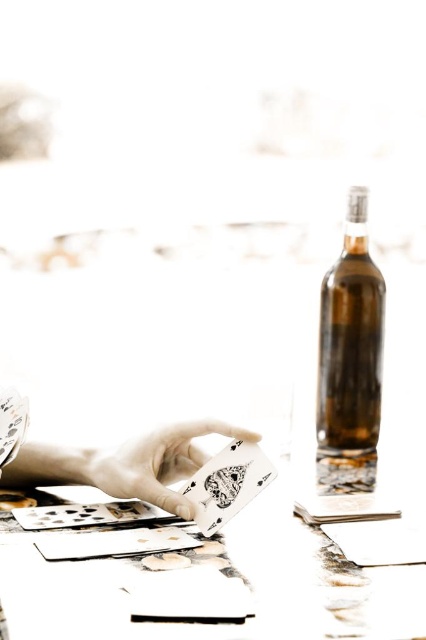
Does white matte playing card at center come in front of white paper card at center?

That is False.

This screenshot has width=426, height=640. What do you see at coordinates (158, 461) in the screenshot?
I see `white matte playing card at center` at bounding box center [158, 461].

Image resolution: width=426 pixels, height=640 pixels. What are the coordinates of `white matte playing card at center` in the screenshot? It's located at (158, 461).

Does white paper table at center have a lesser height compared to white paper card at center?

Yes, white paper table at center is shorter than white paper card at center.

Does point (8, 596) lie in front of point (192, 499)?

Yes.

This screenshot has width=426, height=640. I want to click on white paper table at center, so click(x=313, y=584).

Is point (336, 442) positioned after point (253, 472)?

That is True.

Is brown glass bottle at right smaller than white paper card at center?

Actually, brown glass bottle at right might be larger than white paper card at center.

Does point (345, 305) come closer to viewer compared to point (230, 509)?

No, (345, 305) is further to viewer.

At what (x,y) coordinates should I click in order to perform the action: click on brown glass bottle at right. Please return your answer as a coordinate pair (x, y). The image size is (426, 640). Looking at the image, I should click on (351, 344).